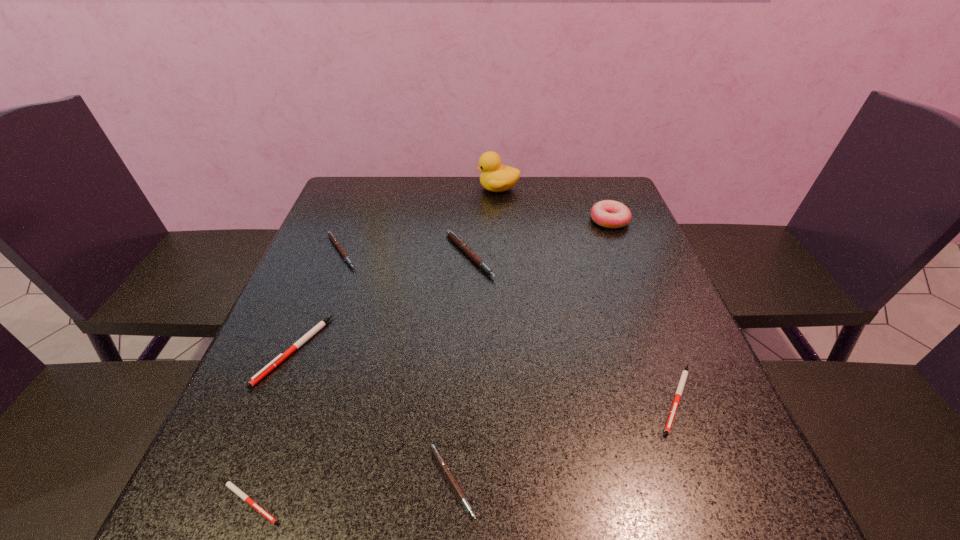
Identify which white pen is the second closest to the smallest pink pen. Please provide its 2D coordinates. Your answer should be formatted as a tuple, i.e. [(x, y)], where the tuple contains the x and y coordinates of a point satisfying the conditions above.

[(268, 368)]

Where is `vacant space that satisfies the following two spatial constraints: 1. on the front-facing side of the second farthest object; 2. on the left side of the farthest object`? vacant space that satisfies the following two spatial constraints: 1. on the front-facing side of the second farthest object; 2. on the left side of the farthest object is located at coordinates pyautogui.click(x=500, y=220).

Where is `free space that satisfies the following two spatial constraints: 1. on the clicker of the rightmost pen; 2. at the nib of the smallest pink pen`? This screenshot has width=960, height=540. free space that satisfies the following two spatial constraints: 1. on the clicker of the rightmost pen; 2. at the nib of the smallest pink pen is located at coordinates (708, 481).

Image resolution: width=960 pixels, height=540 pixels. What are the coordinates of `vacant region that satisfies the following two spatial constraints: 1. on the front side of the doughnut; 2. at the nib of the nearest pink pen` in the screenshot? It's located at (712, 481).